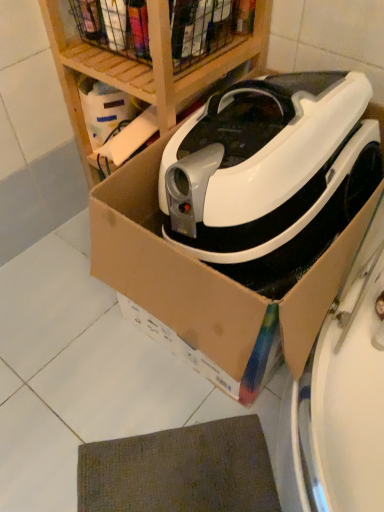
Question: Considering the relative sizes of white glossy robotic vacuum cleaner at center and cardboard box at center in the image provided, is white glossy robotic vacuum cleaner at center shorter than cardboard box at center?

Choices:
 (A) yes
 (B) no

Answer: (A)

Question: Is white glossy robotic vacuum cleaner at center bigger than cardboard box at center?

Choices:
 (A) yes
 (B) no

Answer: (B)

Question: Are white glossy robotic vacuum cleaner at center and cardboard box at center located far from each other?

Choices:
 (A) yes
 (B) no

Answer: (B)

Question: Is the depth of white glossy robotic vacuum cleaner at center greater than that of cardboard box at center?

Choices:
 (A) no
 (B) yes

Answer: (B)

Question: From the image's perspective, would you say white glossy robotic vacuum cleaner at center is shown under cardboard box at center?

Choices:
 (A) no
 (B) yes

Answer: (A)

Question: Does white glossy robotic vacuum cleaner at center touch cardboard box at center?

Choices:
 (A) yes
 (B) no

Answer: (B)

Question: Is there a large distance between wooden at upper center and white glossy robotic vacuum cleaner at center?

Choices:
 (A) yes
 (B) no

Answer: (B)

Question: Does wooden at upper center have a lesser width compared to white glossy robotic vacuum cleaner at center?

Choices:
 (A) no
 (B) yes

Answer: (B)

Question: Is wooden at upper center facing towards white glossy robotic vacuum cleaner at center?

Choices:
 (A) yes
 (B) no

Answer: (B)

Question: Is wooden at upper center behind white glossy robotic vacuum cleaner at center?

Choices:
 (A) yes
 (B) no

Answer: (A)

Question: Does wooden at upper center have a smaller size compared to white glossy robotic vacuum cleaner at center?

Choices:
 (A) yes
 (B) no

Answer: (B)

Question: Would you say white glossy robotic vacuum cleaner at center is part of wooden at upper center's contents?

Choices:
 (A) yes
 (B) no

Answer: (B)

Question: Is cardboard box at center positioned far away from brown textured mat at lower center?

Choices:
 (A) no
 (B) yes

Answer: (A)